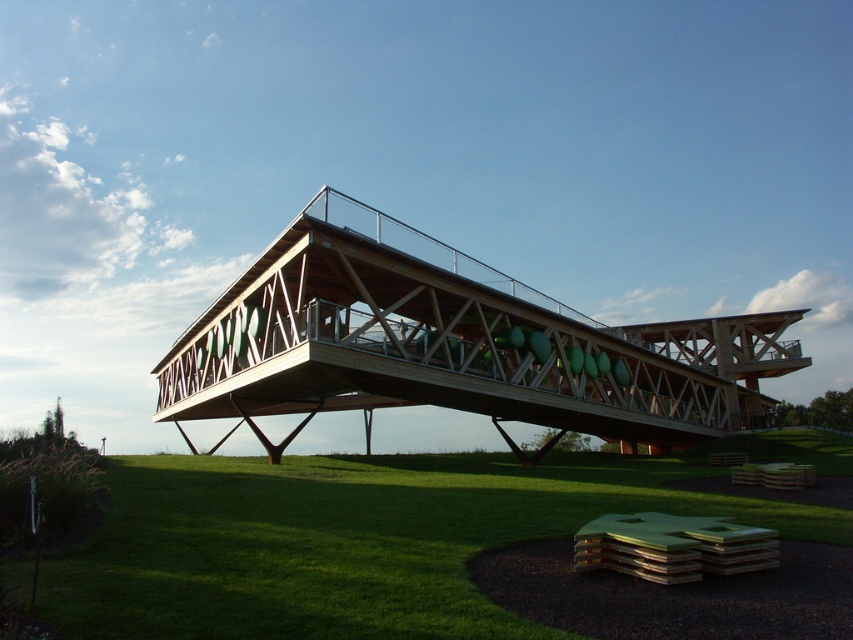
You are a maintenance worker assessing the wooden bridge at center and the green grass at lower center. Which object is taller from the ground up?

The wooden bridge at center is taller than the green grass at lower center.

You are standing at the entrance of the modern architectural structure and want to reach the green grass at lower center. Based on the coordinates provided in the description, can you determine the direction you should walk to reach it?

The green grass at lower center is located at point coordinates, so you should walk towards the lower center direction to reach it.

You are a landscape architect evaluating the space between the green grass at lower center and the wooden bridge at center. Which area is wider?

The wooden bridge at center is wider than the green grass at lower center.